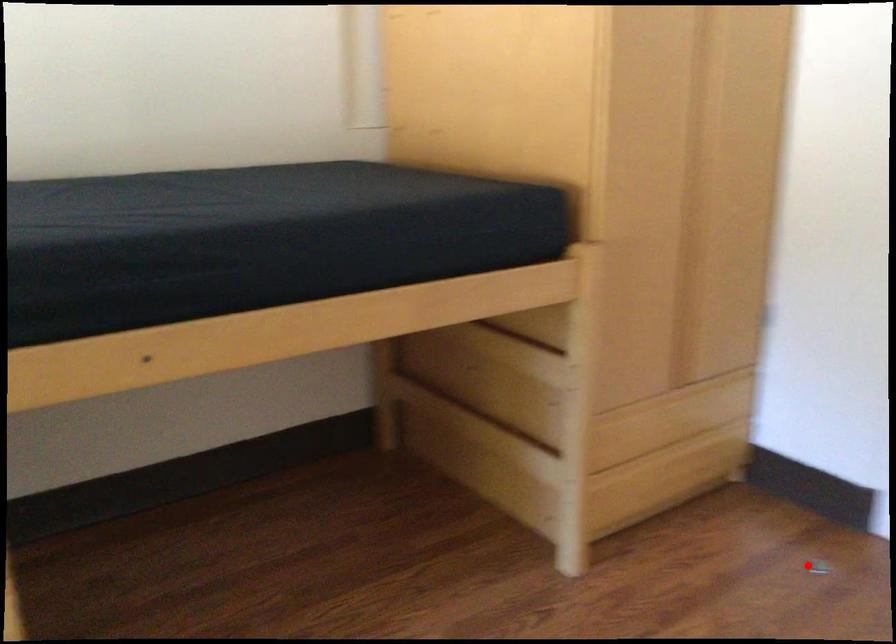
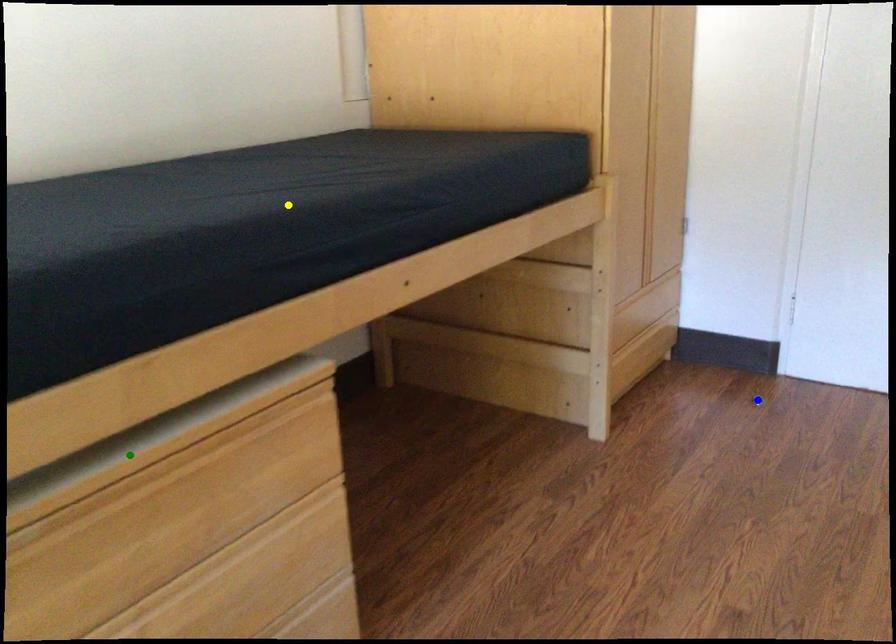
Question: I am providing you with two images of the same scene from different viewpoints. A red point is marked on the first image. You are given multiple points on the second image. Which point in image 2 is actually the same real-world point as the red point in image 1?

Choices:
 (A) green point
 (B) yellow point
 (C) blue point

Answer: (C)